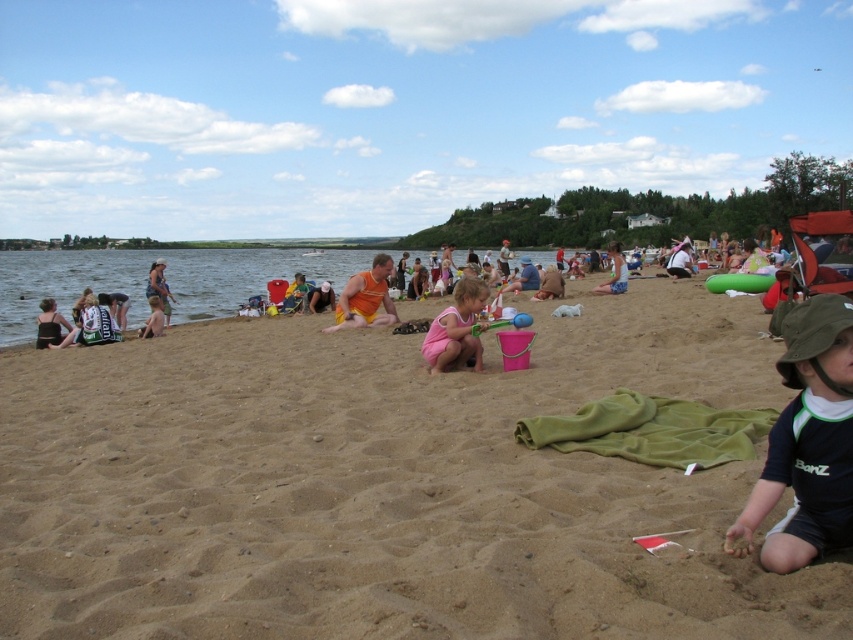
Question: Does green fleece blanket at center appear on the left side of green fabric shorts at center?

Choices:
 (A) no
 (B) yes

Answer: (B)

Question: Can you confirm if clear blue water at center is wider than orange fabric shorts at center?

Choices:
 (A) yes
 (B) no

Answer: (A)

Question: Among these objects, which one is nearest to the camera?

Choices:
 (A) green fabric hat at lower right
 (B) clear blue water at center

Answer: (A)

Question: Among these objects, which one is nearest to the camera?

Choices:
 (A) orange fabric shorts at center
 (B) orange fabric shirt at center

Answer: (A)

Question: Does fine-grained sand at center appear under green fabric hat at lower right?

Choices:
 (A) no
 (B) yes

Answer: (A)

Question: Which object is closer to the camera taking this photo?

Choices:
 (A) pink fabric at center
 (B) black fabric swimsuit at lower left
 (C) clear blue water at center
 (D) green fleece blanket at center

Answer: (D)